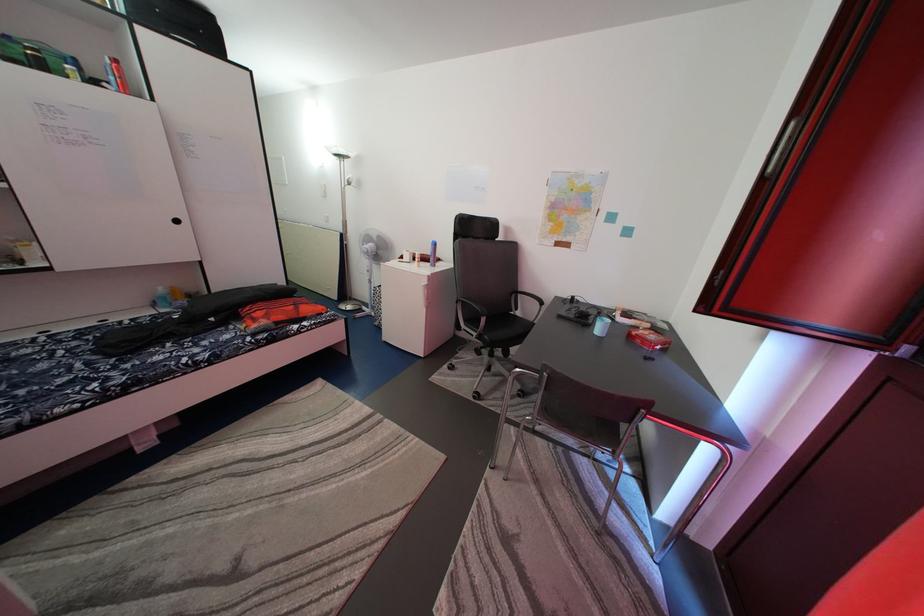
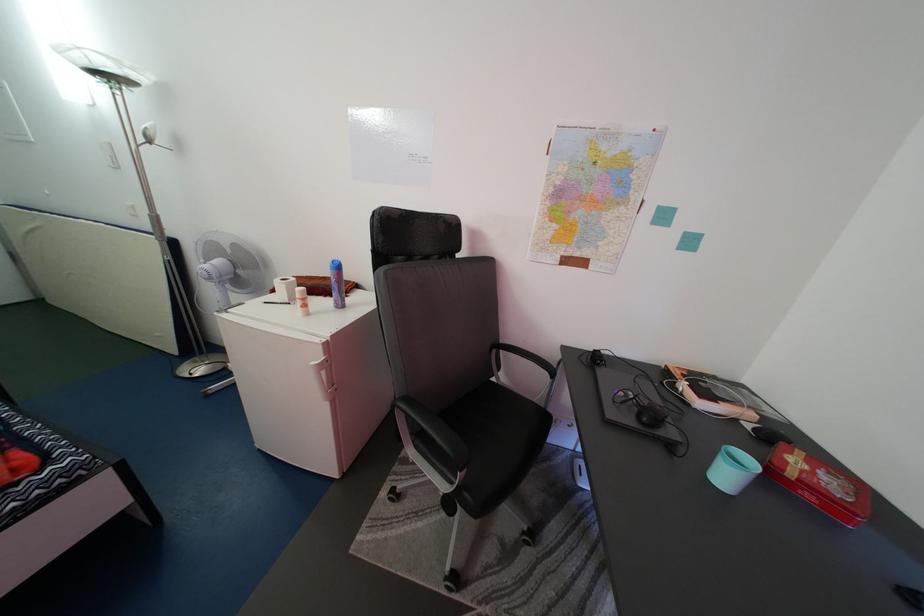
The point at (642, 339) is marked in the first image. Where is the corresponding point in the second image?

(799, 480)